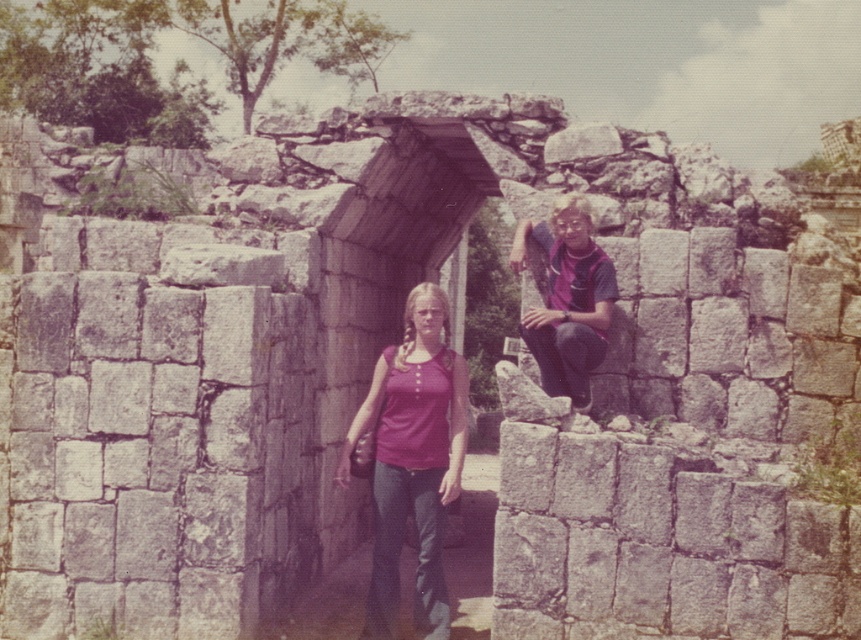
Question: Does matte purple shirt at center appear over purple fabric shirt at upper right?

Choices:
 (A) no
 (B) yes

Answer: (A)

Question: Which point is farther to the camera?

Choices:
 (A) (568, 193)
 (B) (389, 595)

Answer: (A)

Question: Can you confirm if matte purple shirt at center is wider than purple fabric shirt at upper right?

Choices:
 (A) yes
 (B) no

Answer: (B)

Question: Among these points, which one is nearest to the camera?

Choices:
 (A) (420, 340)
 (B) (555, 234)

Answer: (A)

Question: Is matte purple shirt at center thinner than purple fabric shirt at upper right?

Choices:
 (A) yes
 (B) no

Answer: (A)